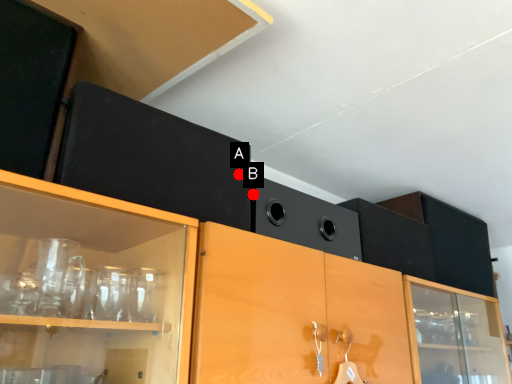
Question: Two points are circled on the image, labeled by A and B beside each circle. Which point appears closest to the camera in this image?

Choices:
 (A) A is closer
 (B) B is closer

Answer: (A)